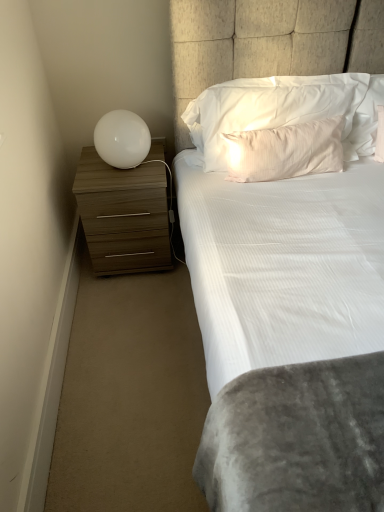
Identify the location of free space in front of wooden chest of drawers at left. The height and width of the screenshot is (512, 384). pos(132,304).